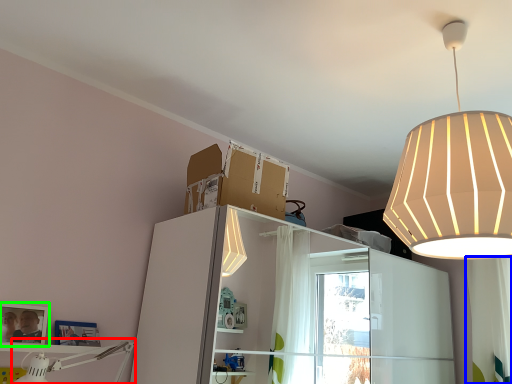
Question: Which object is the farthest from lamp (highlighted by a red box)? Choose among these: curtain (highlighted by a blue box) or picture frame (highlighted by a green box).

Choices:
 (A) curtain
 (B) picture frame

Answer: (A)